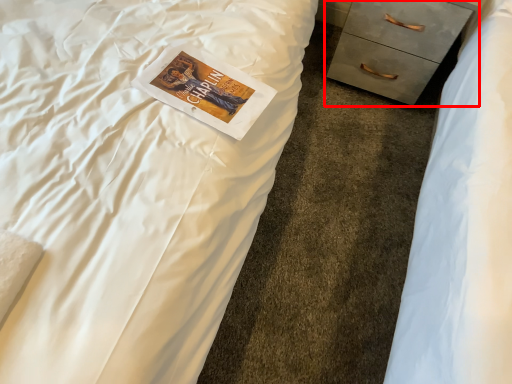
Question: Considering the relative positions of chest of drawers (annotated by the red box) and paperback book in the image provided, where is chest of drawers (annotated by the red box) located with respect to the staircase?

Choices:
 (A) right
 (B) left

Answer: (A)